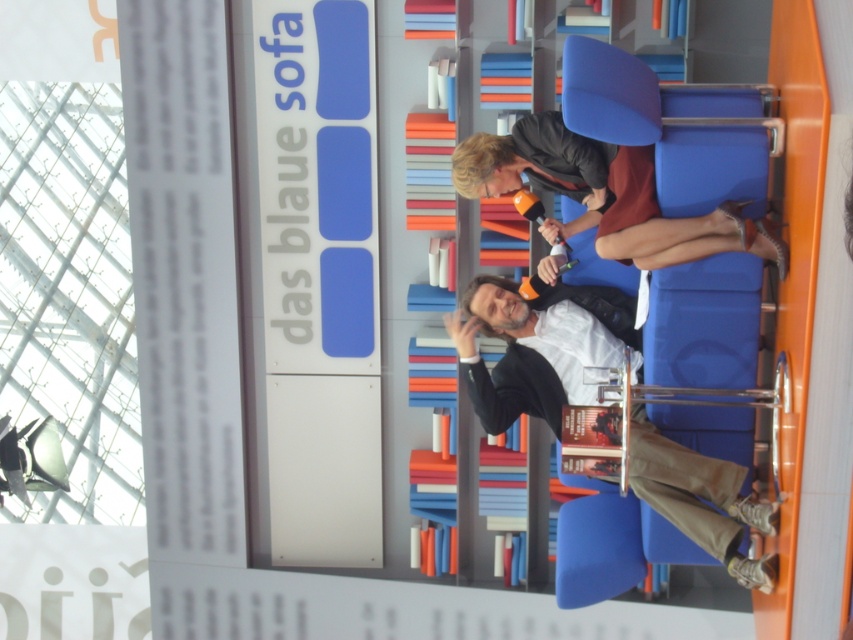
You are organizing a book fair and need to place a 2.5 meter long banner between the stacked books at center and the matte black jacket at upper center. Will the banner fit between them?

The distance between the stacked books at center and the matte black jacket at upper center is 3.61 meters. Since the banner is 2.5 meters long, it will fit comfortably between them with extra space remaining.

Based on the photo, you are an event organizer and need to arrange seating for two guests wearing matte black jackets. You see the matte black jacket at center and the matte black jacket at upper center in the image. Which guest should sit closer to the left side of the stage?

The matte black jacket at center should sit closer to the left side of the stage because it is positioned to the left of the matte black jacket at upper center.